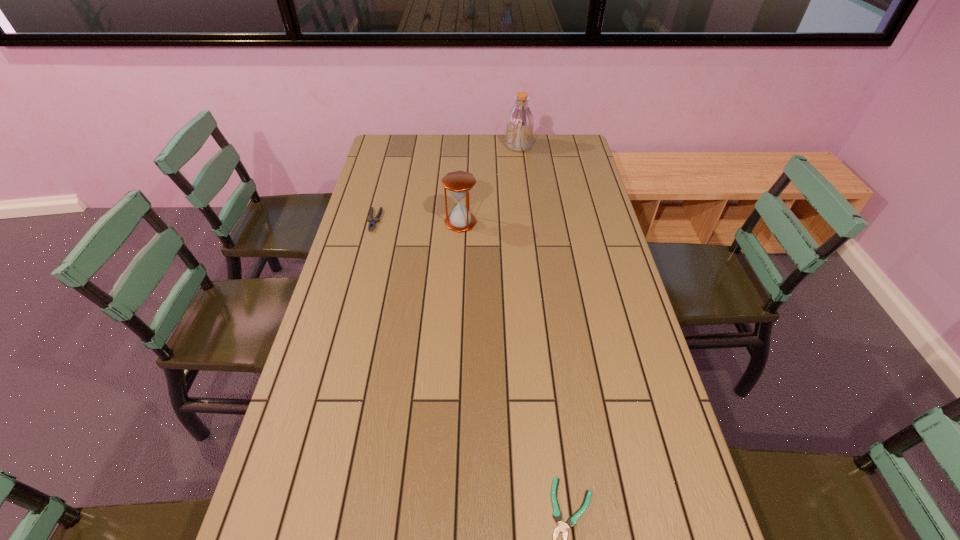
Find the location of `object that is at the left edge`. object that is at the left edge is located at coordinates (376, 219).

Where is `vacant space at the far edge of the desktop`? The width and height of the screenshot is (960, 540). vacant space at the far edge of the desktop is located at coordinates (449, 143).

In the image, there is a desktop. Identify the location of free space at the left edge. This screenshot has height=540, width=960. (306, 428).

In order to click on vacant space at the right edge of the desktop in this screenshot , I will do `click(650, 463)`.

Locate an element on the screen. The image size is (960, 540). free space between the third object from right to left and the left pliers is located at coordinates (418, 221).

The height and width of the screenshot is (540, 960). I want to click on vacant space that is in between the tallest object and the hourglass, so click(490, 184).

You are a GUI agent. You are given a task and a screenshot of the screen. Output one action in this format:
    pyautogui.click(x=<x>, y=<y>)
    Task: Click on the free space between the hourglass and the bottle
    
    Given the screenshot: What is the action you would take?
    pyautogui.click(x=490, y=184)

At what (x,y) coordinates should I click in order to perform the action: click on the closest object relative to the farther pliers. Please return your answer as a coordinate pair (x, y). The width and height of the screenshot is (960, 540). Looking at the image, I should click on (459, 183).

Identify which object is the closest to the leftmost object. Please provide its 2D coordinates. Your answer should be formatted as a tuple, i.e. [(x, y)], where the tuple contains the x and y coordinates of a point satisfying the conditions above.

[(459, 183)]